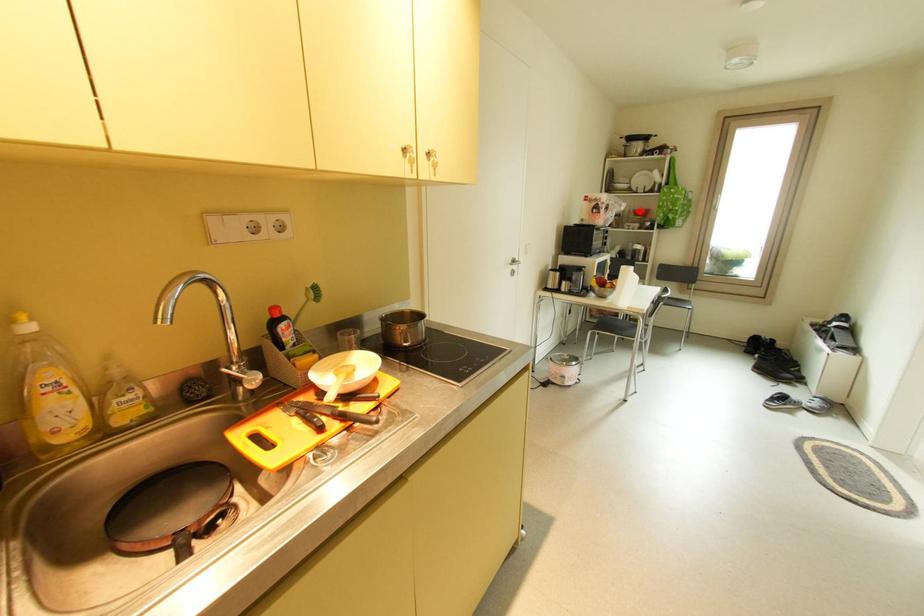
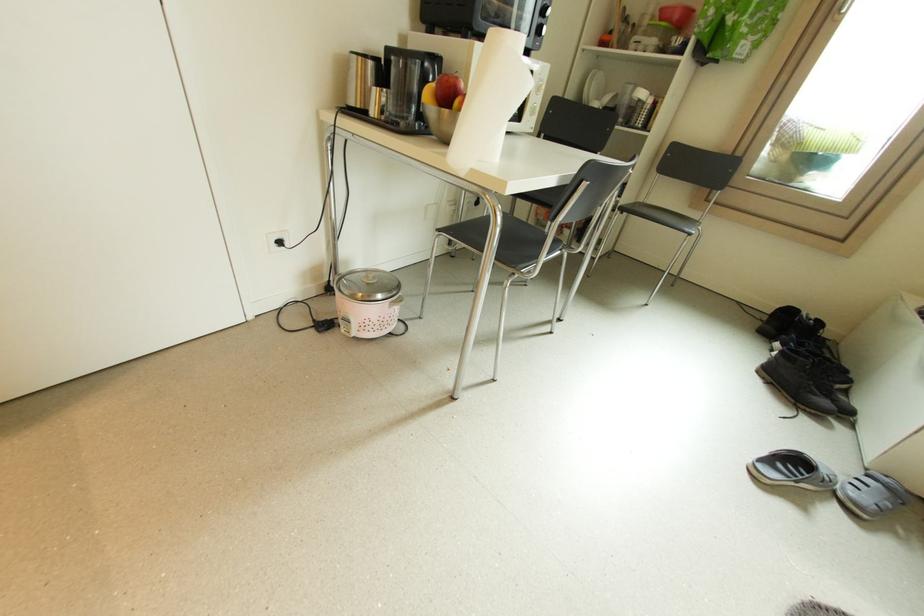
Locate, in the second image, the point that corresponds to the highlighted location in the first image.

(666, 10)